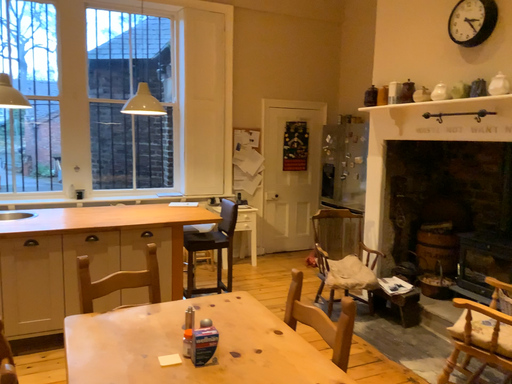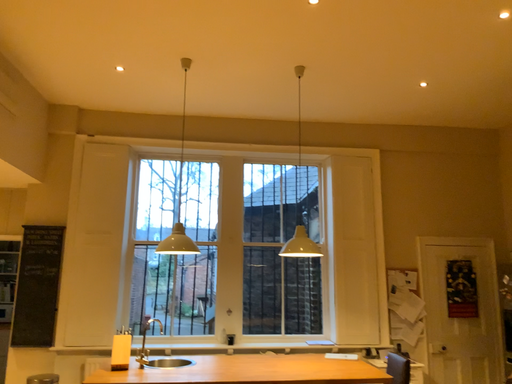
Question: Which way did the camera rotate in the video?

Choices:
 (A) rotated left
 (B) rotated right

Answer: (A)